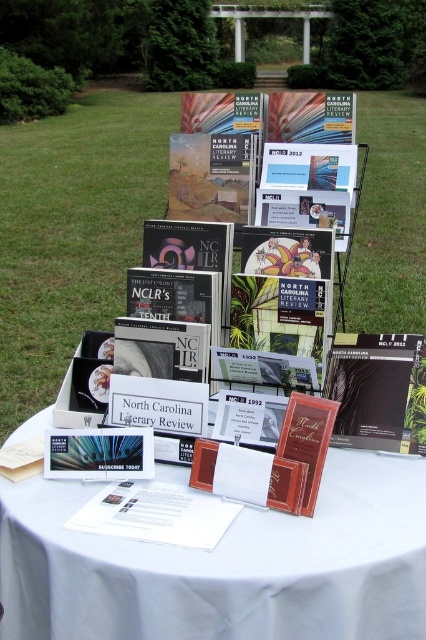
You are organizing a book fair and have a display table with a white cloth at center and a white paper at center. You need to place a decorative ribbon along the edge of the wider item. Which item should you place the ribbon on?

The white cloth at center is wider than the white paper at center, so you should place the decorative ribbon along the edge of the white cloth at center.

Consider the image. You are organizing a book fair and need to place promotional materials on a table. The table has a white cloth at center and a white paper at center. According to the scene description, which item is positioned to the right of the other?

The white cloth at center is to the right of the white paper at center.

You are organizing a book fair and need to place a promotional banner between the white cloth at center and the matte red card at center. According to the scene description, which object should the banner be placed to the right of?

The banner should be placed to the right of the white cloth at center because the white cloth at center is positioned on the left side of the matte red card at center.